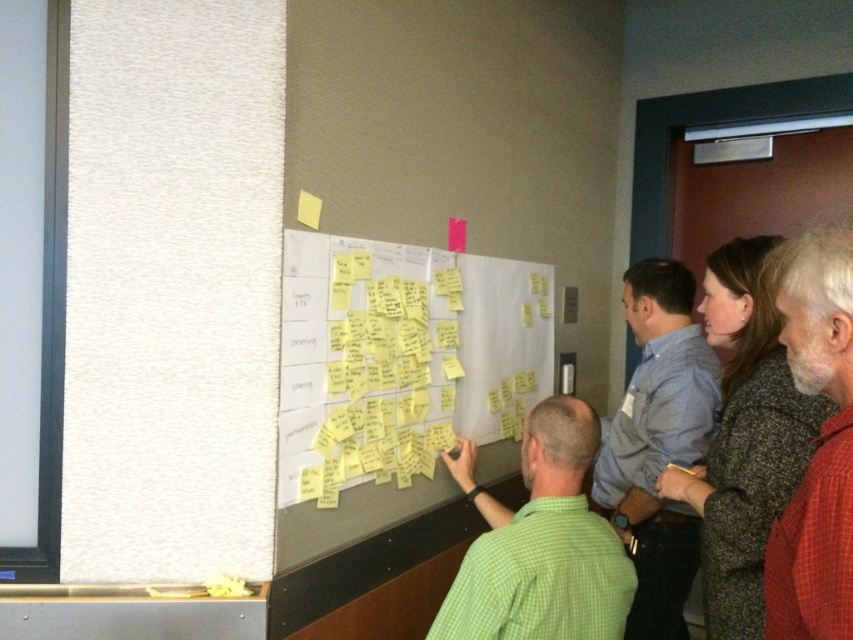
Can you confirm if blue shirt at right is taller than red plaid shirt at right?

Yes, blue shirt at right is taller than red plaid shirt at right.

Does blue shirt at right lie in front of red plaid shirt at right?

No.

Find the location of a particular element. Image resolution: width=853 pixels, height=640 pixels. blue shirt at right is located at coordinates coord(659,442).

Can you confirm if yellow sticky notes at center is bigger than red plaid shirt at right?

Yes.

This screenshot has width=853, height=640. What do you see at coordinates (401, 356) in the screenshot?
I see `yellow sticky notes at center` at bounding box center [401, 356].

Is point (439, 394) positioned behind point (764, 269)?

Yes.

What are the coordinates of `yellow sticky notes at center` in the screenshot? It's located at (401, 356).

Can you confirm if green checkered shirt at center is bigger than red plaid shirt at right?

No.

The height and width of the screenshot is (640, 853). I want to click on green checkered shirt at center, so click(x=540, y=544).

Locate an element on the screen. This screenshot has height=640, width=853. green checkered shirt at center is located at coordinates (540, 544).